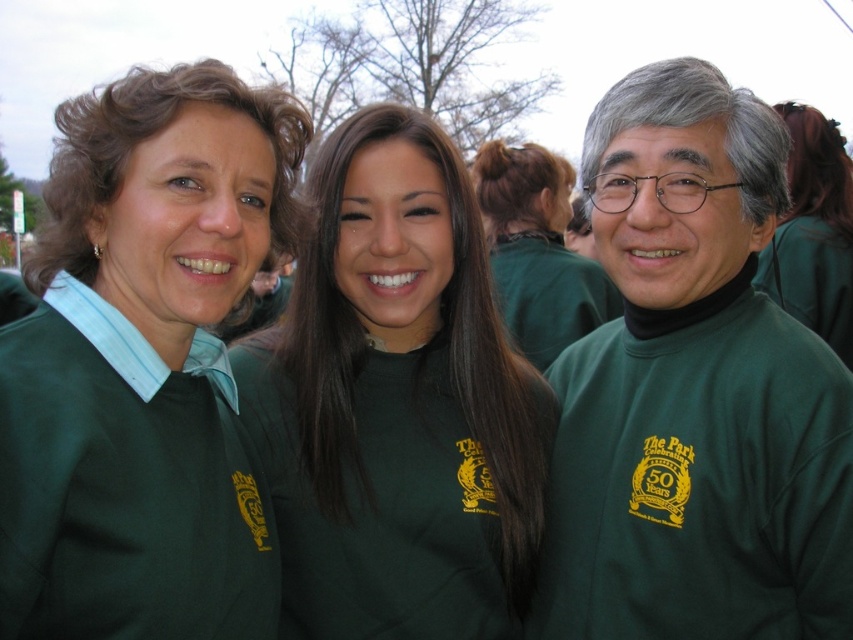
Question: Which object is the farthest from the green matte shirt at upper right?

Choices:
 (A) green matte sweater at left
 (B) green matte shirt at center
 (C) green turtleneck sweater at right
 (D) green matte sweatshirt at center

Answer: (A)

Question: Among these objects, which one is farthest from the camera?

Choices:
 (A) green matte sweatshirt at center
 (B) green matte sweater at left

Answer: (A)

Question: Based on their relative distances, which object is farther from the green matte shirt at center?

Choices:
 (A) green matte shirt at upper right
 (B) green turtleneck sweater at right
 (C) green matte sweater at left
 (D) green matte sweatshirt at center

Answer: (C)

Question: Is green matte shirt at center smaller than green matte shirt at upper right?

Choices:
 (A) yes
 (B) no

Answer: (B)

Question: Can you confirm if green matte sweater at left is positioned to the left of green matte shirt at center?

Choices:
 (A) yes
 (B) no

Answer: (A)

Question: Where is green matte sweater at left located in relation to green matte shirt at center in the image?

Choices:
 (A) right
 (B) left

Answer: (B)